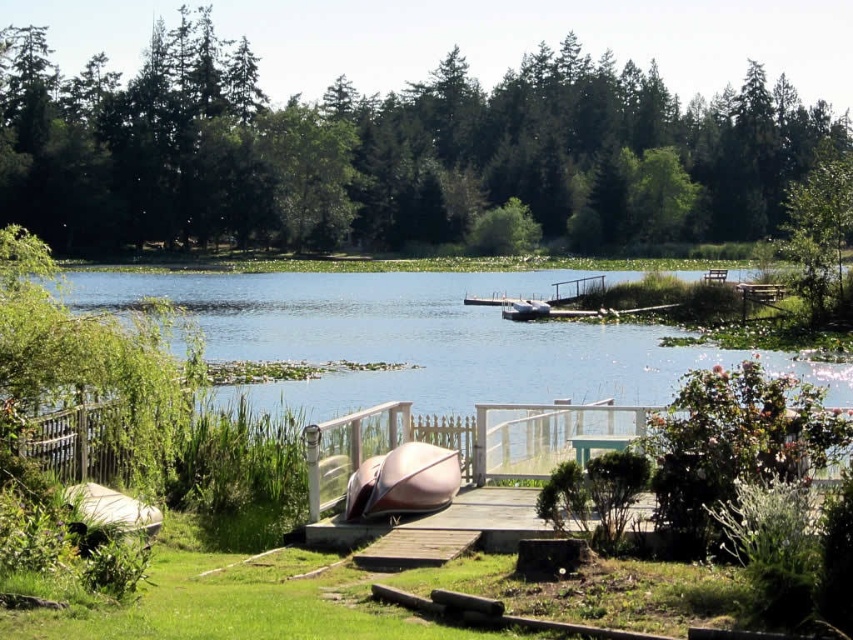
Question: Which of the following is the farthest from the observer?

Choices:
 (A) (416, 358)
 (B) (509, 307)

Answer: (B)

Question: Which point is closer to the camera?

Choices:
 (A) (824, 176)
 (B) (425, 22)
 (C) (395, 490)

Answer: (C)

Question: Is wooden dock at center to the right of metallic pink canoe at center from the viewer's perspective?

Choices:
 (A) yes
 (B) no

Answer: (A)

Question: Does metallic pink canoe at center have a lesser width compared to metallic silver boat at center?

Choices:
 (A) no
 (B) yes

Answer: (A)

Question: Considering the relative positions of clear blue water at center and metallic pink canoe at center in the image provided, where is clear blue water at center located with respect to metallic pink canoe at center?

Choices:
 (A) above
 (B) below

Answer: (A)

Question: Estimate the real-world distances between objects in this image. Which object is closer to the green leafy tree at upper right?

Choices:
 (A) clear blue water at center
 (B) green matte tree at upper center
 (C) metallic pink canoe at center

Answer: (A)